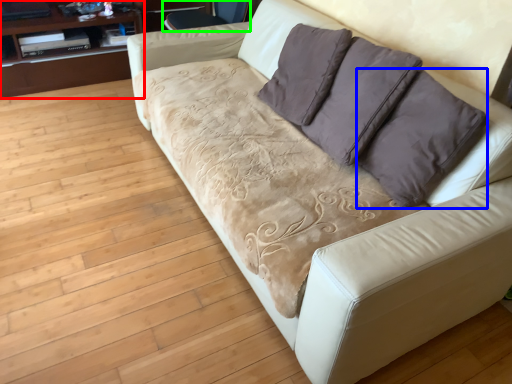
Question: Estimate the real-world distances between objects in this image. Which object is closer to dresser (highlighted by a red box), throw pillow (highlighted by a blue box) or armchair (highlighted by a green box)?

Choices:
 (A) throw pillow
 (B) armchair

Answer: (B)